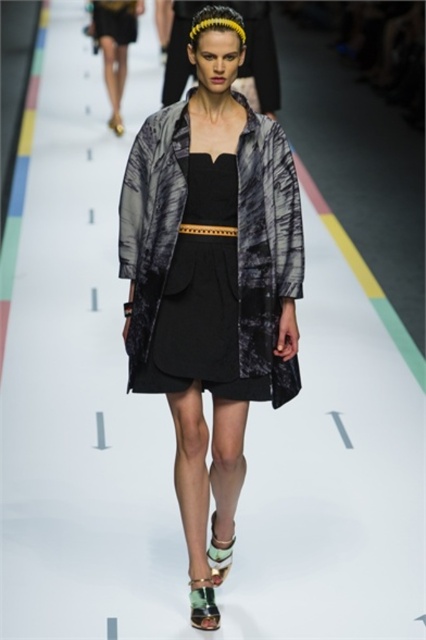
You are a photographer at the runway show. You notice the shiny metallic sandal at lower center and the green suede sandal at center. Which sandal is closer to the camera?

The shiny metallic sandal at lower center is positioned under the green suede sandal at center, so the green suede sandal at center is closer to the camera.

You are a photographer at the runway show and need to capture a closeup of the black leather belt at center and the shiny metallic sandal at lower center. Since the runway is white with gray arrows, where should you position yourself to ensure both the belt and sandal are visible in the frame?

Position yourself so that you can see both the shiny metallic sandal at lower center and the black leather belt at center. Since the shiny metallic sandal at lower center is located below the black leather belt at center, you should aim your camera downward from the belt towards the sandal to include both in the frame.